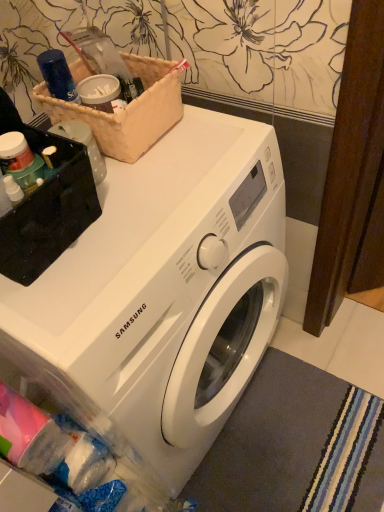
Question: Is brown woven basket at upper left taller or shorter than white glossy washing machine at center?

Choices:
 (A) short
 (B) tall

Answer: (A)

Question: Which is correct: brown woven basket at upper left is inside white glossy washing machine at center, or outside of it?

Choices:
 (A) inside
 (B) outside

Answer: (B)

Question: Considering the real-world distances, which object is farthest from the brown woven basket at upper left?

Choices:
 (A) gray soft carpet at lower right
 (B) white glossy washing machine at center

Answer: (A)

Question: Which object is the farthest from the white glossy washing machine at center?

Choices:
 (A) gray soft carpet at lower right
 (B) brown woven basket at upper left

Answer: (A)